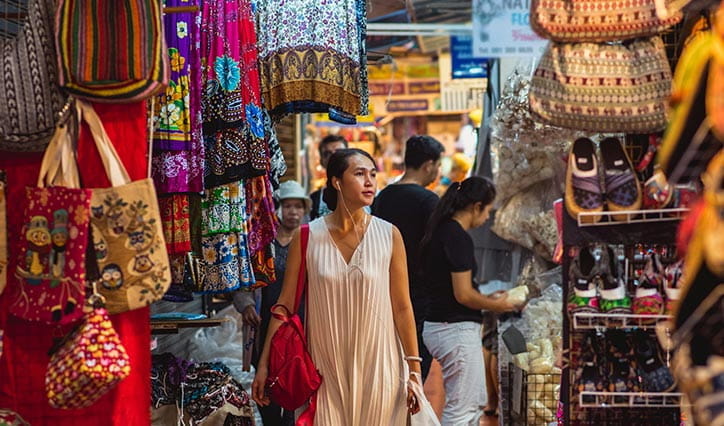
You are a GUI agent. You are given a task and a screenshot of the screen. Output one action in this format:
    pyautogui.click(x=<x>, y=<y>)
    Task: Click on the bags hanging up
    
    Given the screenshot: What is the action you would take?
    pyautogui.click(x=49, y=239), pyautogui.click(x=148, y=243), pyautogui.click(x=77, y=362), pyautogui.click(x=615, y=96), pyautogui.click(x=610, y=11), pyautogui.click(x=24, y=93), pyautogui.click(x=104, y=56)